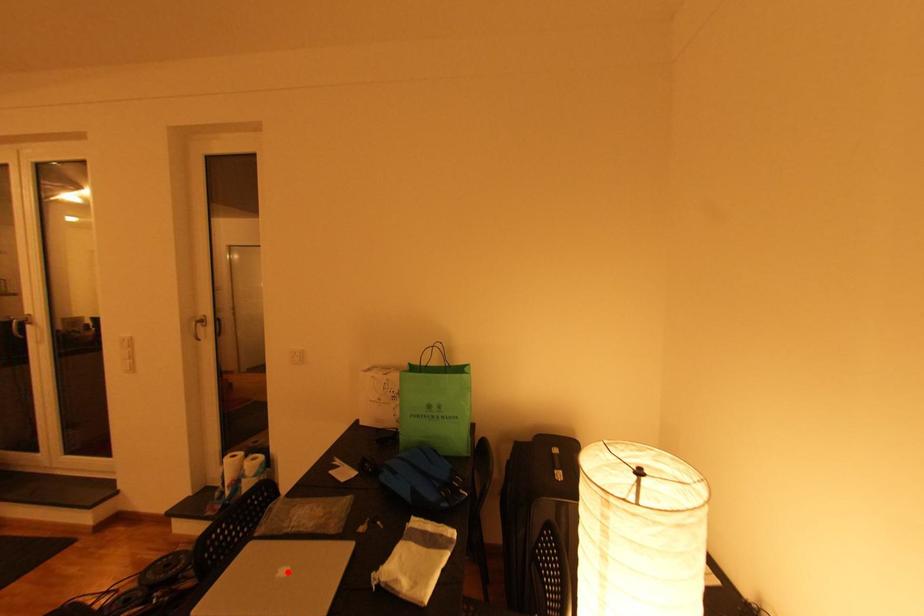
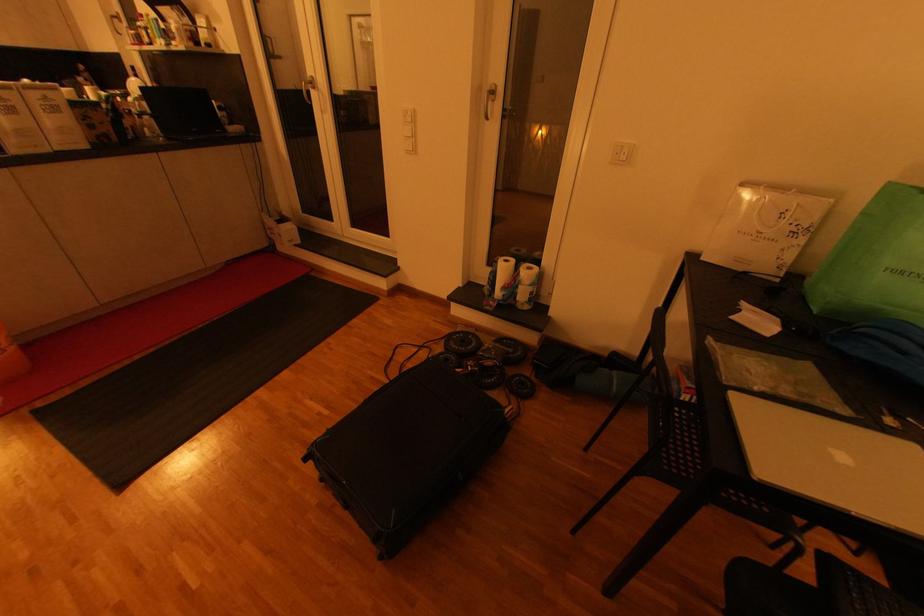
Find the pixel in the second image that matches the highlighted location in the first image.

(845, 458)